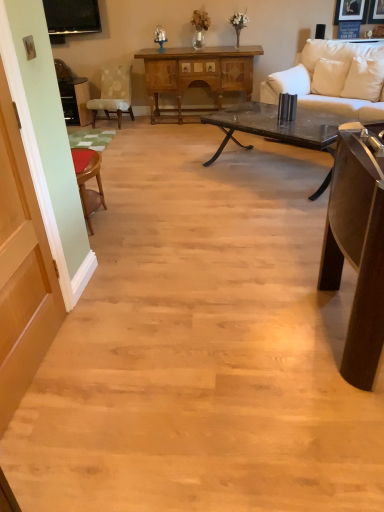
In order to click on vacant space in front of wooden cabinet at center, which ranks as the 1th table in top-to-bottom order in this screenshot , I will do `click(182, 140)`.